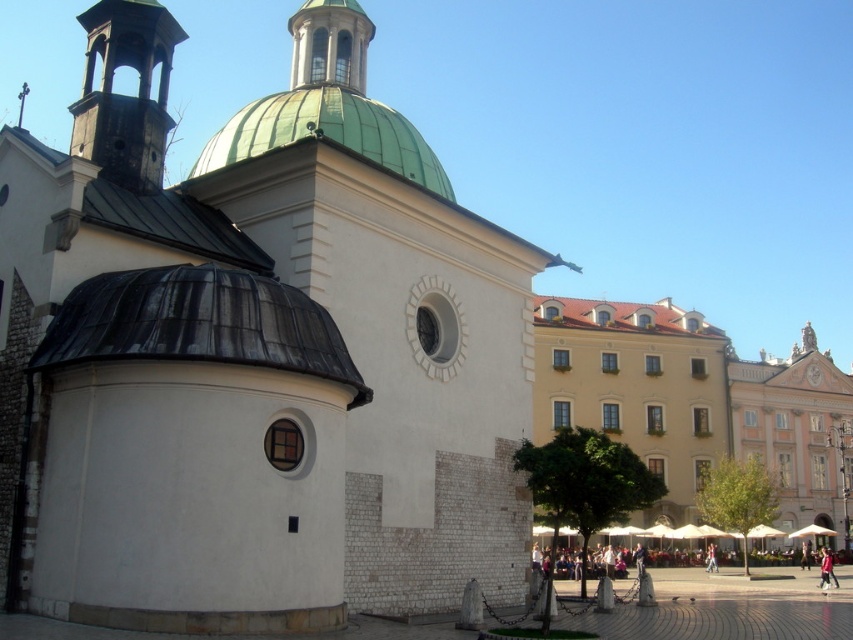
Who is lower down, green copper dome at center or green dome at upper center?

green copper dome at center is lower down.

Does point (277, 116) lie behind point (322, 33)?

No, it is not.

Locate an element on the screen. The width and height of the screenshot is (853, 640). green copper dome at center is located at coordinates (328, 104).

Based on the photo, is rusty metal bell tower at upper left to the left of green dome at upper center from the viewer's perspective?

Correct, you'll find rusty metal bell tower at upper left to the left of green dome at upper center.

Is rusty metal bell tower at upper left positioned in front of green dome at upper center?

Yes, it is.

What are the coordinates of `rusty metal bell tower at upper left` in the screenshot? It's located at (125, 93).

Find the location of a particular element. Image resolution: width=853 pixels, height=640 pixels. rusty metal bell tower at upper left is located at coordinates (125, 93).

Who is higher up, white stone church at center or green copper dome at center?

green copper dome at center is higher up.

Between white stone church at center and green copper dome at center, which one is positioned lower?

white stone church at center is below.

Which is behind, point (62, 435) or point (204, 160)?

The point (204, 160) is more distant.

I want to click on white stone church at center, so click(250, 362).